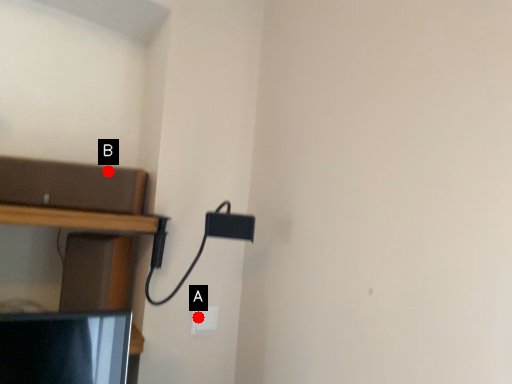
Question: Two points are circled on the image, labeled by A and B beside each circle. Which point is farther from the camera taking this photo?

Choices:
 (A) A is further
 (B) B is further

Answer: (A)